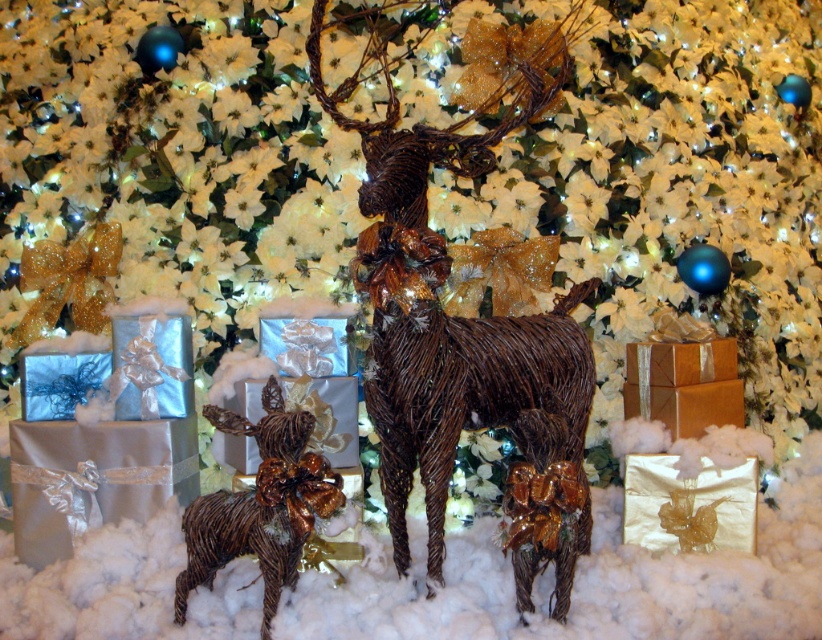
Who is positioned more to the right, brown textured reindeer at center or shiny gold figurine at lower left?

Positioned to the right is brown textured reindeer at center.

Does brown textured reindeer at center appear on the right side of shiny gold figurine at lower left?

Correct, you'll find brown textured reindeer at center to the right of shiny gold figurine at lower left.

At what (x,y) coordinates should I click in order to perform the action: click on brown textured reindeer at center. Please return your answer as a coordinate pair (x, y). This screenshot has height=640, width=822. Looking at the image, I should click on (463, 336).

You are a GUI agent. You are given a task and a screenshot of the screen. Output one action in this format:
    pyautogui.click(x=<x>, y=<y>)
    Task: Click on the brown textured reindeer at center
    The height and width of the screenshot is (640, 822).
    Given the screenshot: What is the action you would take?
    pyautogui.click(x=463, y=336)